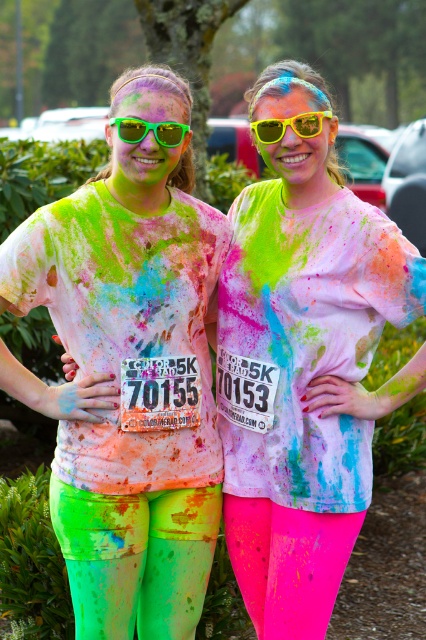
Is neon pink leggings at center positioned behind yellow matte sunglasses at center?

Yes, it is behind yellow matte sunglasses at center.

Is neon pink leggings at center to the left of yellow matte sunglasses at center from the viewer's perspective?

No, neon pink leggings at center is not to the left of yellow matte sunglasses at center.

Where is `neon pink leggings at center`? The height and width of the screenshot is (640, 426). neon pink leggings at center is located at coordinates (302, 376).

The height and width of the screenshot is (640, 426). Find the location of `neon pink leggings at center`. neon pink leggings at center is located at coordinates pos(302,376).

Between point (183, 237) and point (172, 140), which one is positioned in front?

Positioned in front is point (172, 140).

Is point (63, 316) closer to camera compared to point (181, 125)?

No, it is not.

Where is `neon green fabric shirt at center`? The image size is (426, 640). neon green fabric shirt at center is located at coordinates (127, 385).

Which is below, neon pink leggings at center or green reflective sunglasses at center?

neon pink leggings at center is lower down.

Who is positioned more to the left, neon pink leggings at center or green reflective sunglasses at center?

Positioned to the left is green reflective sunglasses at center.

Is point (261, 100) behind point (138, 138)?

Yes.

I want to click on neon pink leggings at center, so (302, 376).